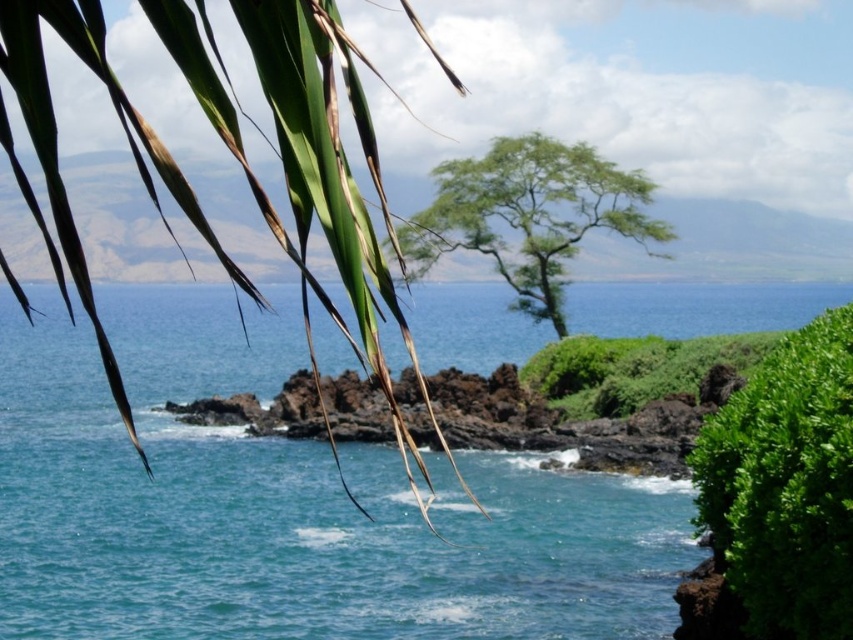
Is green leafy palm tree at upper left wider than green leafy tree at center?

Indeed, green leafy palm tree at upper left has a greater width compared to green leafy tree at center.

What do you see at coordinates (311, 173) in the screenshot?
I see `green leafy palm tree at upper left` at bounding box center [311, 173].

Describe the element at coordinates (311, 173) in the screenshot. I see `green leafy palm tree at upper left` at that location.

Image resolution: width=853 pixels, height=640 pixels. Find the location of `green leafy palm tree at upper left`. green leafy palm tree at upper left is located at coordinates (311, 173).

Consider the image. Does green leafy palm tree at upper left appear under green leafy bush at lower right?

No.

Is green leafy palm tree at upper left above green leafy bush at lower right?

Yes, green leafy palm tree at upper left is above green leafy bush at lower right.

The width and height of the screenshot is (853, 640). What are the coordinates of `green leafy palm tree at upper left` in the screenshot? It's located at (311, 173).

Identify the location of green leafy palm tree at upper left. (311, 173).

Can you confirm if green leafy bush at lower right is taller than green leafy tree at center?

In fact, green leafy bush at lower right may be shorter than green leafy tree at center.

Who is positioned more to the right, green leafy bush at lower right or green leafy tree at center?

green leafy bush at lower right

Which is behind, point (799, 625) or point (575, 154)?

Point (575, 154)

Identify the location of green leafy bush at lower right. point(778,497).